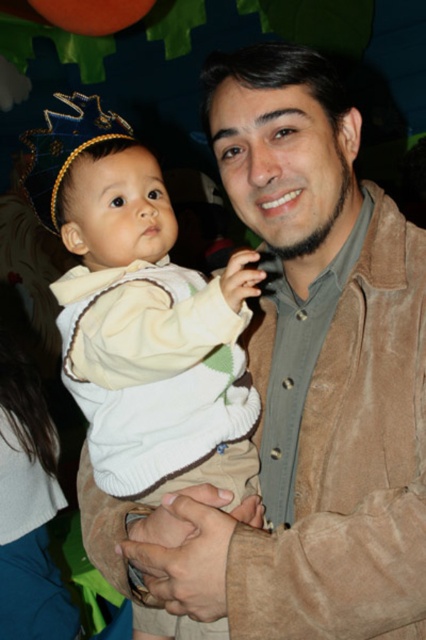
Does white fleece sweater at center appear on the right side of blue fabric crown at upper left?

Yes, white fleece sweater at center is to the right of blue fabric crown at upper left.

Does white fleece sweater at center appear on the left side of blue fabric crown at upper left?

No, white fleece sweater at center is not to the left of blue fabric crown at upper left.

Between point (183, 364) and point (54, 230), which one is positioned behind?

The point (54, 230) is more distant.

The height and width of the screenshot is (640, 426). Identify the location of white fleece sweater at center. (141, 314).

Can you confirm if suede jacket at center is thinner than white fleece sweater at center?

No.

Does suede jacket at center have a greater width compared to white fleece sweater at center?

Indeed, suede jacket at center has a greater width compared to white fleece sweater at center.

Does point (169, 570) come farther from viewer compared to point (244, 310)?

Yes, point (169, 570) is behind point (244, 310).

The width and height of the screenshot is (426, 640). Identify the location of suede jacket at center. (314, 376).

Who is taller, suede jacket at center or blue fabric crown at upper left?

suede jacket at center

In the scene shown: Which is more to the left, suede jacket at center or blue fabric crown at upper left?

blue fabric crown at upper left

Who is more forward, (385,256) or (34,173)?

Point (385,256) is more forward.

Identify the location of suede jacket at center. The image size is (426, 640). (314, 376).